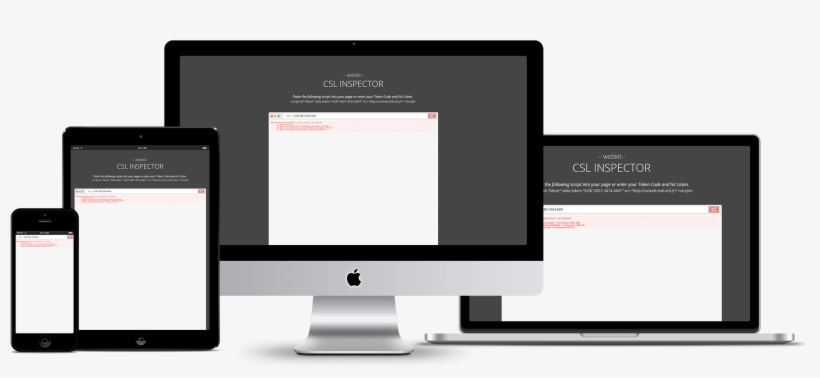
Where is `large tablet`? large tablet is located at coordinates (93, 176).